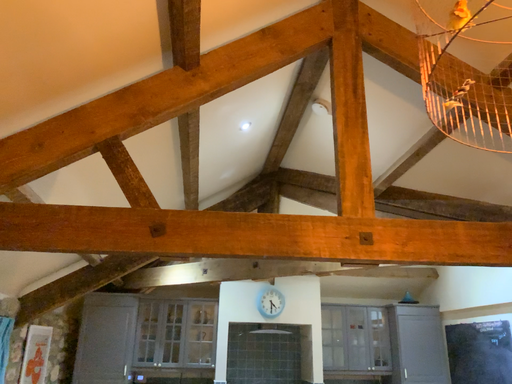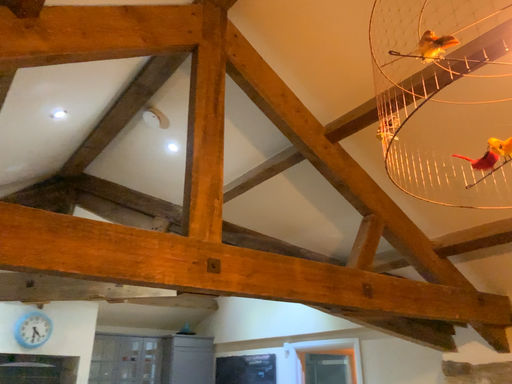
Question: How did the camera likely rotate when shooting the video?

Choices:
 (A) rotated right
 (B) rotated left

Answer: (A)